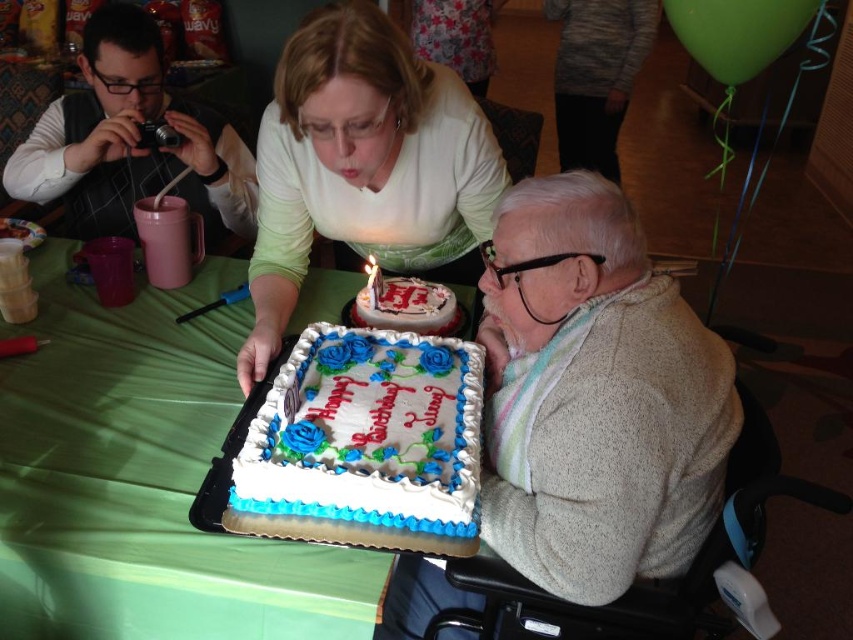
Question: Is white frosted cake with blue and green decorations at center smaller than white paper birthday candle at center?

Choices:
 (A) yes
 (B) no

Answer: (B)

Question: Which of the following is the closest to the observer?

Choices:
 (A) (218, 179)
 (B) (432, 310)
 (C) (373, 278)
 (D) (160, 472)

Answer: (D)

Question: Does green fabric table at lower left have a smaller size compared to white frosted cake at center?

Choices:
 (A) yes
 (B) no

Answer: (B)

Question: Among these objects, which one is nearest to the camera?

Choices:
 (A) white frosted cake with blue and green decorations at center
 (B) matte white shirt at center

Answer: (B)

Question: Can you confirm if matte black camera at upper left is positioned above white paper birthday candle at center?

Choices:
 (A) no
 (B) yes

Answer: (B)

Question: Estimate the real-world distances between objects in this image. Which object is closer to the white paper birthday candle at center?

Choices:
 (A) matte white shirt at center
 (B) white textured sweater at lower right
 (C) matte black camera at upper left

Answer: (A)